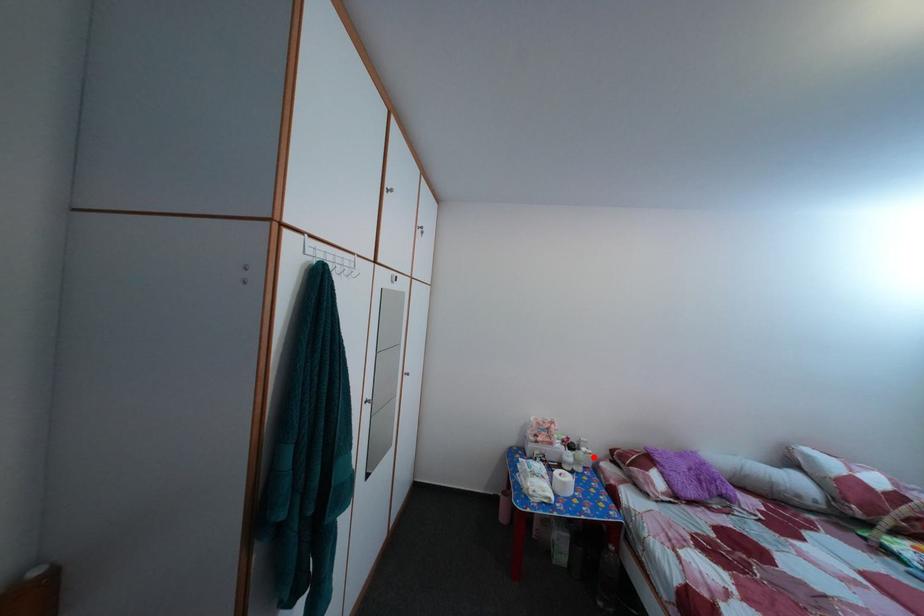
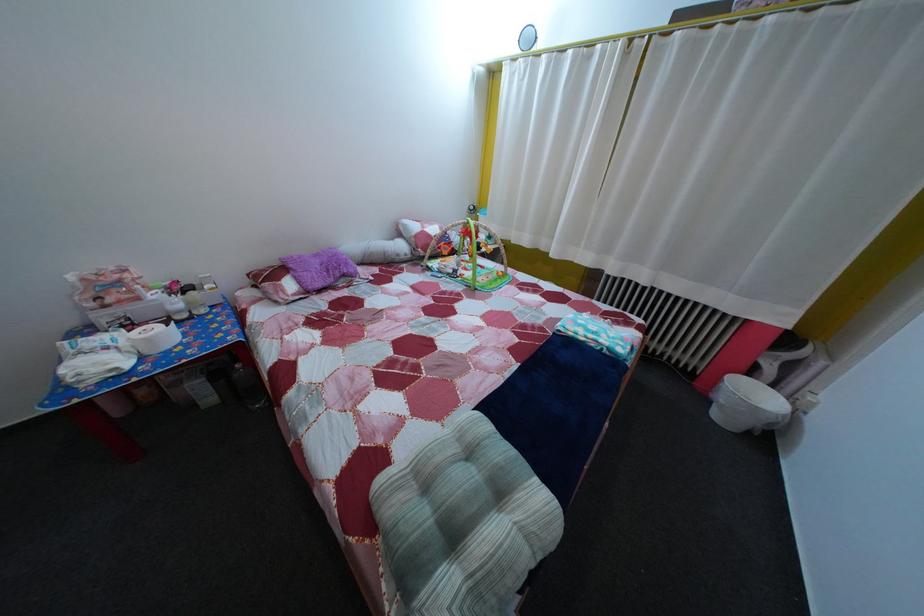
Question: I am providing you with two images of the same scene from different viewpoints. Given a red point in image1, look at the same physical point in image2. Is it:

Choices:
 (A) Closer to the viewpoint
 (B) Farther from the viewpoint

Answer: (A)